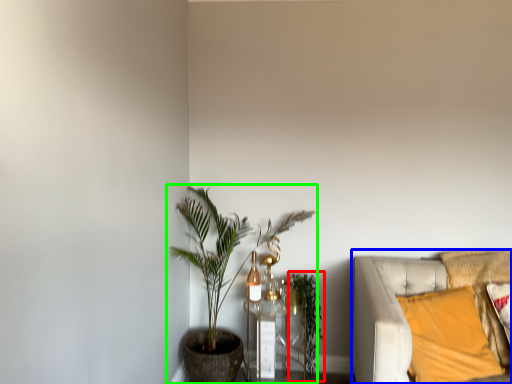
Question: Which object is positioned closest to vegetation (highlighted by a red box)? Select from studio couch (highlighted by a blue box) and houseplant (highlighted by a green box).

Choices:
 (A) studio couch
 (B) houseplant

Answer: (B)